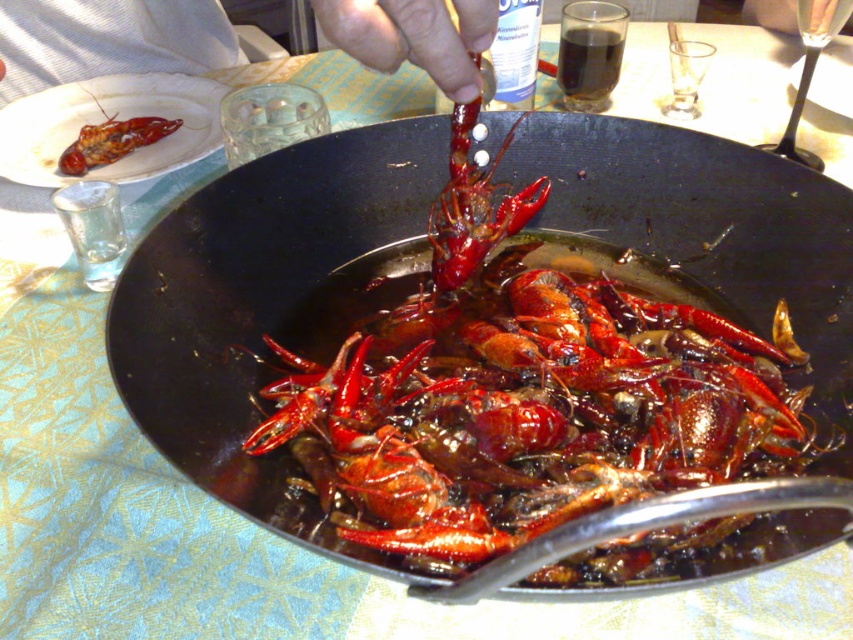
Does black matte wok at center appear under matte red lobster at upper left?

Yes, black matte wok at center is below matte red lobster at upper left.

Is black matte wok at center closer to the viewer compared to matte red lobster at upper left?

Yes.

Which is behind, point (407, 573) or point (70, 145)?

Positioned behind is point (70, 145).

Locate an element on the screen. The image size is (853, 640). black matte wok at center is located at coordinates (270, 307).

Does smooth skin hand at upper center have a greater width compared to matte black plate at upper left?

No.

Which is above, smooth skin hand at upper center or matte black plate at upper left?

smooth skin hand at upper center is above.

Which is in front, point (393, 68) or point (62, 148)?

Positioned in front is point (393, 68).

This screenshot has height=640, width=853. What are the coordinates of `smooth skin hand at upper center` in the screenshot? It's located at (x=413, y=36).

Looking at this image, is smooth skin hand at upper center below matte red lobster at upper left?

Actually, smooth skin hand at upper center is above matte red lobster at upper left.

Between point (126, 33) and point (100, 102), which one is positioned behind?

Positioned behind is point (126, 33).

Is point (442, 56) closer to camera compared to point (178, 118)?

That is True.

Find the location of a particular element. This screenshot has width=853, height=640. smooth skin hand at upper center is located at coordinates (413, 36).